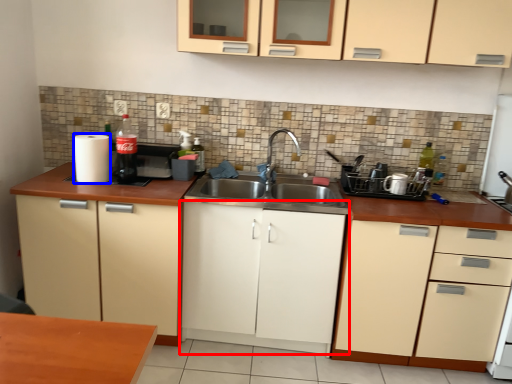
Question: Among these objects, which one is nearest to the camera, cabinetry (highlighted by a red box) or paper towel (highlighted by a blue box)?

Choices:
 (A) cabinetry
 (B) paper towel

Answer: (A)